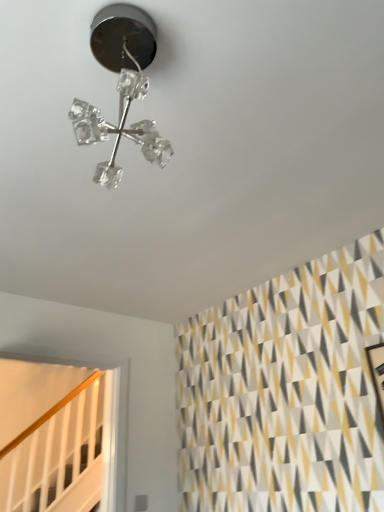
Where is `clear crystal chandelier at upper center`? The width and height of the screenshot is (384, 512). clear crystal chandelier at upper center is located at coordinates (121, 86).

What do you see at coordinates (121, 86) in the screenshot? Image resolution: width=384 pixels, height=512 pixels. I see `clear crystal chandelier at upper center` at bounding box center [121, 86].

Measure the distance between white wooden stairwell at lower left and camera.

A distance of 3.17 meters exists between white wooden stairwell at lower left and camera.

Image resolution: width=384 pixels, height=512 pixels. I want to click on white wooden stairwell at lower left, so click(x=55, y=444).

Describe the element at coordinates (55, 444) in the screenshot. This screenshot has width=384, height=512. I see `white wooden stairwell at lower left` at that location.

Find the location of a particular element. The width and height of the screenshot is (384, 512). clear crystal chandelier at upper center is located at coordinates (121, 86).

Which object is positioned more to the left, clear crystal chandelier at upper center or white wooden stairwell at lower left?

From the viewer's perspective, white wooden stairwell at lower left appears more on the left side.

Is clear crystal chandelier at upper center further to camera compared to white wooden stairwell at lower left?

No.

Is point (141, 140) in front of point (22, 485)?

Yes, point (141, 140) is in front of point (22, 485).

From the image's perspective, does clear crystal chandelier at upper center appear higher than white wooden stairwell at lower left?

Correct, clear crystal chandelier at upper center appears higher than white wooden stairwell at lower left in the image.

From a real-world perspective, is clear crystal chandelier at upper center located higher than white wooden stairwell at lower left?

Indeed, from a real-world perspective, clear crystal chandelier at upper center stands above white wooden stairwell at lower left.

In terms of width, does clear crystal chandelier at upper center look wider or thinner when compared to white wooden stairwell at lower left?

Considering their sizes, clear crystal chandelier at upper center looks broader than white wooden stairwell at lower left.

Is clear crystal chandelier at upper center shorter than white wooden stairwell at lower left?

Yes.

Who is bigger, clear crystal chandelier at upper center or white wooden stairwell at lower left?

white wooden stairwell at lower left is bigger.

Is clear crystal chandelier at upper center completely or partially outside of white wooden stairwell at lower left?

Yes, clear crystal chandelier at upper center is located beyond the bounds of white wooden stairwell at lower left.

Does clear crystal chandelier at upper center touch white wooden stairwell at lower left?

clear crystal chandelier at upper center and white wooden stairwell at lower left are clearly separated.

Is clear crystal chandelier at upper center oriented towards white wooden stairwell at lower left?

Yes, clear crystal chandelier at upper center is turned towards white wooden stairwell at lower left.

How different are the orientations of clear crystal chandelier at upper center and white wooden stairwell at lower left in degrees?

clear crystal chandelier at upper center and white wooden stairwell at lower left are facing 179 degrees away from each other.

The image size is (384, 512). What are the coordinates of `stairwell below the clear crystal chandelier at upper center (from the image's perspective)` in the screenshot? It's located at (55, 444).

Which is more to the right, white wooden stairwell at lower left or clear crystal chandelier at upper center?

From the viewer's perspective, clear crystal chandelier at upper center appears more on the right side.

Which is in front, white wooden stairwell at lower left or clear crystal chandelier at upper center?

clear crystal chandelier at upper center is in front.

From the picture: Which point is more distant from viewer, (61, 426) or (154, 161)?

The point (61, 426) is more distant.

From the image's perspective, is white wooden stairwell at lower left located above or below clear crystal chandelier at upper center?

white wooden stairwell at lower left is below clear crystal chandelier at upper center.

From a real-world perspective, is white wooden stairwell at lower left positioned under clear crystal chandelier at upper center based on gravity?

Yes, from a real-world perspective, white wooden stairwell at lower left is beneath clear crystal chandelier at upper center.

Is white wooden stairwell at lower left wider than clear crystal chandelier at upper center?

In fact, white wooden stairwell at lower left might be narrower than clear crystal chandelier at upper center.

Consider the image. Considering the sizes of white wooden stairwell at lower left and clear crystal chandelier at upper center in the image, is white wooden stairwell at lower left taller or shorter than clear crystal chandelier at upper center?

In the image, white wooden stairwell at lower left appears to be taller than clear crystal chandelier at upper center.

Who is bigger, white wooden stairwell at lower left or clear crystal chandelier at upper center?

white wooden stairwell at lower left is bigger.

Choose the correct answer: Is white wooden stairwell at lower left inside clear crystal chandelier at upper center or outside it?

white wooden stairwell at lower left lies outside clear crystal chandelier at upper center.

Is white wooden stairwell at lower left positioned far away from clear crystal chandelier at upper center?

Yes, white wooden stairwell at lower left and clear crystal chandelier at upper center are quite far apart.

Could you tell me if white wooden stairwell at lower left is facing clear crystal chandelier at upper center?

Yes, white wooden stairwell at lower left is turned towards clear crystal chandelier at upper center.

How many degrees apart are the facing directions of white wooden stairwell at lower left and clear crystal chandelier at upper center?

They differ by 179 degrees in their facing directions.

This screenshot has width=384, height=512. In order to click on stairwell that appears below the clear crystal chandelier at upper center (from the image's perspective) in this screenshot , I will do `click(55, 444)`.

What are the coordinates of `lamp located on the right of white wooden stairwell at lower left` in the screenshot? It's located at (121, 86).

Find the location of a particular element. Image resolution: width=384 pixels, height=512 pixels. lamp above the white wooden stairwell at lower left (from a real-world perspective) is located at coordinates (121, 86).